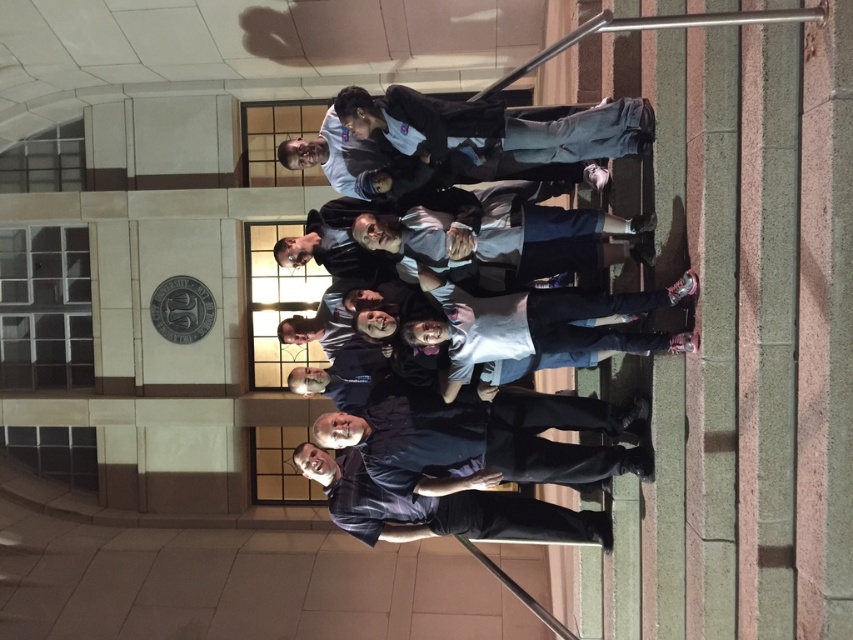
Which is more to the right, dark blue shirt at center or dark blue shirt at lower center?

Positioned to the right is dark blue shirt at center.

Is dark blue shirt at center thinner than dark blue shirt at lower center?

Yes, dark blue shirt at center is thinner than dark blue shirt at lower center.

Does point (383, 483) come farther from viewer compared to point (543, 525)?

No, (383, 483) is in front of (543, 525).

Locate an element on the screen. The width and height of the screenshot is (853, 640). dark blue shirt at center is located at coordinates (483, 435).

Is dark gray uniform at center to the right of dark blue shirt at center from the viewer's perspective?

In fact, dark gray uniform at center is to the left of dark blue shirt at center.

Which is more to the right, dark gray uniform at center or dark blue shirt at center?

Positioned to the right is dark blue shirt at center.

Where is `dark gray uniform at center`? dark gray uniform at center is located at coordinates (445, 182).

Does gray cotton shirt at center have a greater width compared to dark blue shirt at lower center?

No, gray cotton shirt at center is not wider than dark blue shirt at lower center.

Consider the image. Is gray cotton shirt at center to the left of dark blue shirt at lower center from the viewer's perspective?

Incorrect, gray cotton shirt at center is not on the left side of dark blue shirt at lower center.

Is point (440, 304) less distant than point (422, 499)?

Yes, it is in front of point (422, 499).

Image resolution: width=853 pixels, height=640 pixels. Identify the location of gray cotton shirt at center. (538, 324).